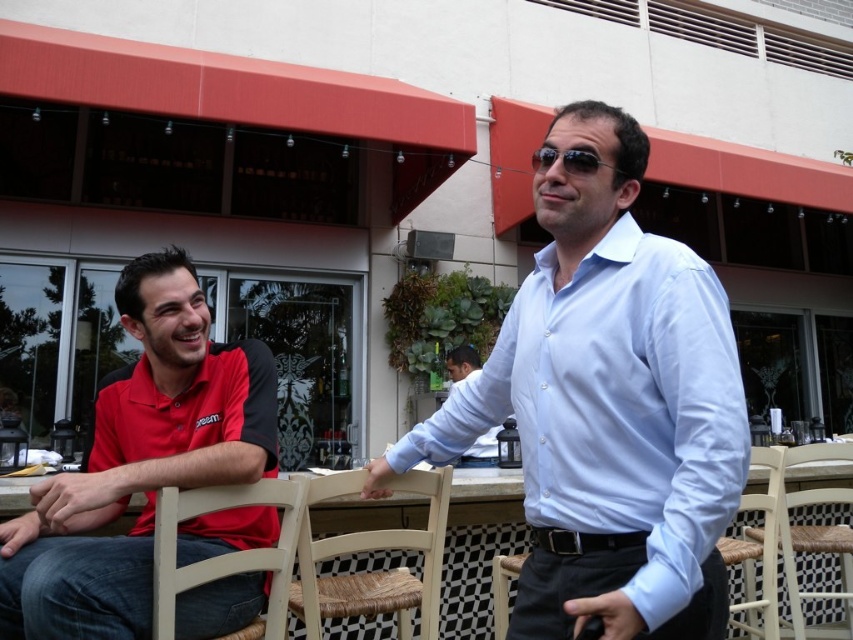
Question: Is white glossy shirt at center positioned before white wicker chair at lower center?

Choices:
 (A) yes
 (B) no

Answer: (A)

Question: Is black matte hand at lower center wider than light blue shirt at center?

Choices:
 (A) yes
 (B) no

Answer: (B)

Question: Estimate the real-world distances between objects in this image. Which object is closer to the matte red polo shirt at left?

Choices:
 (A) white wicker chair at lower center
 (B) light blue shirt at center
 (C) sunglasses at center
 (D) white glossy shirt at center

Answer: (D)

Question: Among these points, which one is nearest to the camera?

Choices:
 (A) (280, 576)
 (B) (740, 547)

Answer: (A)

Question: Which of the following is the closest to the observer?

Choices:
 (A) black matte hand at lower center
 (B) woven wood chair at lower right
 (C) matte red polo shirt at left
 (D) light beige wood chair at lower left

Answer: (A)

Question: Is matte red polo shirt at left to the right of light beige wood chair at lower left from the viewer's perspective?

Choices:
 (A) yes
 (B) no

Answer: (B)